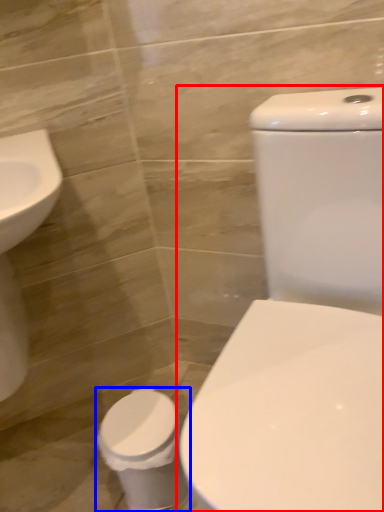
Question: Which point is closer to the camera, toilet (highlighted by a red box) or toilet bowl (highlighted by a blue box)?

Choices:
 (A) toilet
 (B) toilet bowl

Answer: (A)